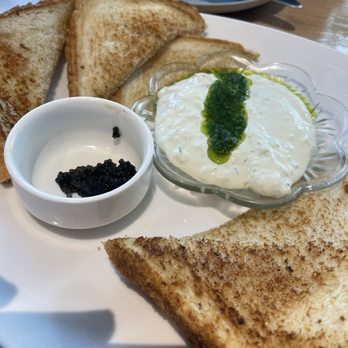
The width and height of the screenshot is (348, 348). Identify the location of scalloped edges on crystal plate. (340, 103), (302, 69), (339, 176).